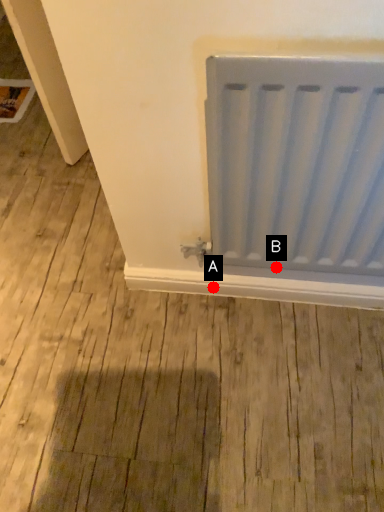
Question: Two points are circled on the image, labeled by A and B beside each circle. Among these points, which one is farthest from the camera?

Choices:
 (A) A is further
 (B) B is further

Answer: (A)